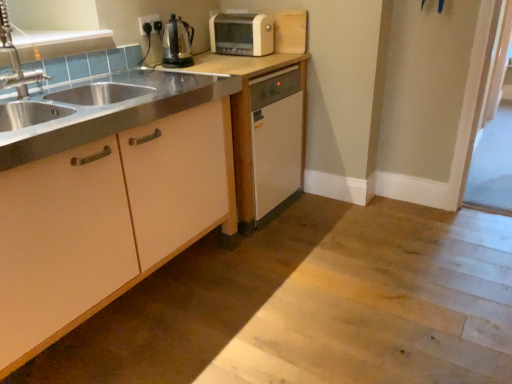
Question: From the image's perspective, is shiny metallic kettle at upper center on matte white cabinet at left, placed as the 1th cabinetry when sorted from front to back?

Choices:
 (A) yes
 (B) no

Answer: (A)

Question: Does shiny metallic kettle at upper center have a greater width compared to matte white cabinet at left, marked as the second cabinetry in a back-to-front arrangement?

Choices:
 (A) yes
 (B) no

Answer: (B)

Question: Does shiny metallic kettle at upper center have a larger size compared to matte white cabinet at left, placed as the 1th cabinetry when sorted from front to back?

Choices:
 (A) yes
 (B) no

Answer: (B)

Question: Is shiny metallic kettle at upper center thinner than matte white cabinet at left, marked as the second cabinetry in a back-to-front arrangement?

Choices:
 (A) yes
 (B) no

Answer: (A)

Question: Is there a large distance between shiny metallic kettle at upper center and matte white cabinet at left, marked as the second cabinetry in a back-to-front arrangement?

Choices:
 (A) no
 (B) yes

Answer: (A)

Question: Is shiny metallic kettle at upper center behind matte white cabinet at left, placed as the 1th cabinetry when sorted from front to back?

Choices:
 (A) yes
 (B) no

Answer: (A)

Question: Is shiny metallic kettle at upper center surrounded by matte white dishwasher at center, which is the second cabinetry in front-to-back order?

Choices:
 (A) no
 (B) yes

Answer: (A)

Question: From the image's perspective, is matte white dishwasher at center, which is the second cabinetry in front-to-back order, on shiny metallic kettle at upper center?

Choices:
 (A) yes
 (B) no

Answer: (B)

Question: Is matte white dishwasher at center, which is the second cabinetry in front-to-back order, far from shiny metallic kettle at upper center?

Choices:
 (A) no
 (B) yes

Answer: (A)

Question: Is matte white dishwasher at center, which is the second cabinetry in front-to-back order, oriented away from shiny metallic kettle at upper center?

Choices:
 (A) no
 (B) yes

Answer: (A)

Question: From the image's perspective, is matte white dishwasher at center, acting as the first cabinetry starting from the back, under shiny metallic kettle at upper center?

Choices:
 (A) yes
 (B) no

Answer: (A)

Question: Does matte white dishwasher at center, which is the second cabinetry in front-to-back order, come in front of shiny metallic kettle at upper center?

Choices:
 (A) yes
 (B) no

Answer: (A)

Question: From the image's perspective, is matte white cabinet at left, marked as the second cabinetry in a back-to-front arrangement, above black plastic electric outlet at upper center?

Choices:
 (A) no
 (B) yes

Answer: (A)